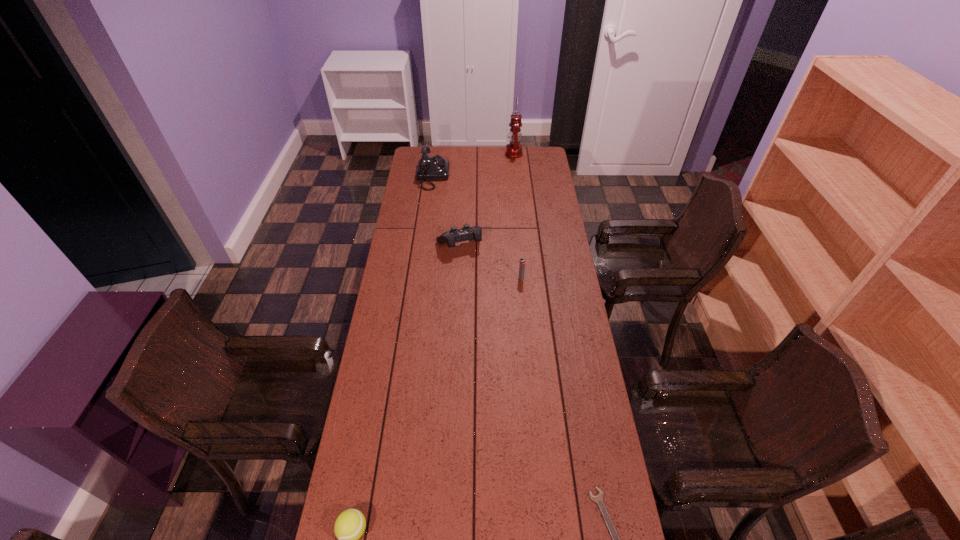
Where is `blank space at the far right corner of the desktop`? The width and height of the screenshot is (960, 540). blank space at the far right corner of the desktop is located at coordinates (545, 167).

This screenshot has height=540, width=960. Find the location of `free space that is in between the farthest object and the fifth shortest object`. free space that is in between the farthest object and the fifth shortest object is located at coordinates (473, 165).

At what (x,y) coordinates should I click in order to perform the action: click on free spot between the fourth farthest object and the tallest object. Please return your answer as a coordinate pair (x, y). Looking at the image, I should click on (517, 216).

Locate an element on the screen. The width and height of the screenshot is (960, 540). free space between the igniter and the farthest object is located at coordinates (517, 216).

Find the location of `vacant space in between the oil lamp and the fifth shortest object`. vacant space in between the oil lamp and the fifth shortest object is located at coordinates (473, 165).

Where is `vacant space that is in between the third farthest object and the igniter`? This screenshot has width=960, height=540. vacant space that is in between the third farthest object and the igniter is located at coordinates (491, 262).

Identify which object is the nearest to the second shortest object. Please provide its 2D coordinates. Your answer should be formatted as a tuple, i.e. [(x, y)], where the tuple contains the x and y coordinates of a point satisfying the conditions above.

[(598, 499)]

The height and width of the screenshot is (540, 960). Find the location of `the second closest object relative to the farthest object`. the second closest object relative to the farthest object is located at coordinates (466, 233).

Locate an element on the screen. Image resolution: width=960 pixels, height=540 pixels. vacant position in the image that satisfies the following two spatial constraints: 1. on the dial of the second tallest object; 2. on the right side of the control is located at coordinates (424, 245).